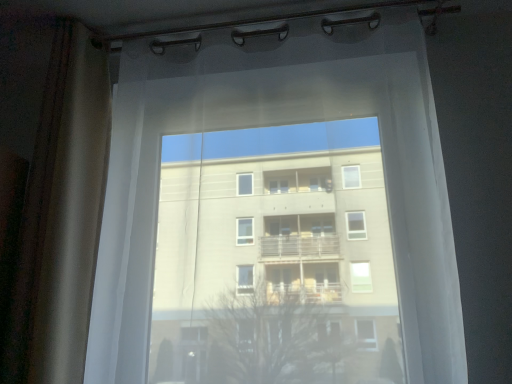
The image size is (512, 384). What are the coordinates of `brown textured curtain at left` in the screenshot? It's located at (49, 195).

What is the approximate height of brown textured curtain at left?

The height of brown textured curtain at left is 1.17 meters.

The height and width of the screenshot is (384, 512). Describe the element at coordinates (49, 195) in the screenshot. I see `brown textured curtain at left` at that location.

The width and height of the screenshot is (512, 384). I want to click on translucent white curtain at center, so click(x=277, y=210).

Describe the element at coordinates (277, 210) in the screenshot. I see `translucent white curtain at center` at that location.

The height and width of the screenshot is (384, 512). I want to click on brown textured curtain at left, so click(x=49, y=195).

Considering the relative positions of translucent white curtain at center and brown textured curtain at left in the image provided, is translucent white curtain at center to the left of brown textured curtain at left from the viewer's perspective?

Incorrect, translucent white curtain at center is not on the left side of brown textured curtain at left.

Is translucent white curtain at center in front of brown textured curtain at left?

Yes, it is in front of brown textured curtain at left.

Is point (154, 131) in front of point (69, 311)?

No, (154, 131) is further to viewer.

From the image's perspective, which is below, translucent white curtain at center or brown textured curtain at left?

translucent white curtain at center, from the image's perspective.

From a real-world perspective, relative to brown textured curtain at left, is translucent white curtain at center vertically above or below?

translucent white curtain at center is below brown textured curtain at left.

Does translucent white curtain at center have a lesser width compared to brown textured curtain at left?

No.

In terms of height, does translucent white curtain at center look taller or shorter compared to brown textured curtain at left?

In the image, translucent white curtain at center appears to be shorter than brown textured curtain at left.

Does translucent white curtain at center have a larger size compared to brown textured curtain at left?

Correct, translucent white curtain at center is larger in size than brown textured curtain at left.

Could brown textured curtain at left be considered to be inside translucent white curtain at center?

Definitely not — brown textured curtain at left is not inside translucent white curtain at center.

Are translucent white curtain at center and brown textured curtain at left located far from each other?

Actually, translucent white curtain at center and brown textured curtain at left are a little close together.

Is translucent white curtain at center looking in the opposite direction of brown textured curtain at left?

That's not correct — translucent white curtain at center is not looking away from brown textured curtain at left.

How different are the orientations of translucent white curtain at center and brown textured curtain at left in degrees?

There is a 5.86e-05-degree angle between the facing directions of translucent white curtain at center and brown textured curtain at left.

This screenshot has height=384, width=512. In order to click on curtain on the right of brown textured curtain at left in this screenshot , I will do `click(277, 210)`.

Can you confirm if brown textured curtain at left is positioned to the left of translucent white curtain at center?

Indeed, brown textured curtain at left is positioned on the left side of translucent white curtain at center.

Which is behind, brown textured curtain at left or translucent white curtain at center?

brown textured curtain at left is more distant.

Which point is more forward, (85, 43) or (324, 329)?

The point (324, 329) is closer to the camera.

From the image's perspective, who appears lower, brown textured curtain at left or translucent white curtain at center?

translucent white curtain at center appears lower in the image.

From a real-world perspective, is brown textured curtain at left beneath translucent white curtain at center?

Actually, brown textured curtain at left is physically above translucent white curtain at center in the real world.

Between brown textured curtain at left and translucent white curtain at center, which one has smaller width?

With smaller width is brown textured curtain at left.

Who is shorter, brown textured curtain at left or translucent white curtain at center?

Standing shorter between the two is translucent white curtain at center.

Looking at this image, is brown textured curtain at left smaller than translucent white curtain at center?

Indeed, brown textured curtain at left has a smaller size compared to translucent white curtain at center.

Choose the correct answer: Is brown textured curtain at left inside translucent white curtain at center or outside it?

brown textured curtain at left is located beyond the bounds of translucent white curtain at center.

Are brown textured curtain at left and translucent white curtain at center located far from each other?

Result: They are positioned close to each other.

Is brown textured curtain at left turned away from translucent white curtain at center?

No, brown textured curtain at left is not facing the opposite direction of translucent white curtain at center.

How many degrees apart are the facing directions of brown textured curtain at left and translucent white curtain at center?

Result: The facing directions of brown textured curtain at left and translucent white curtain at center are 5.86e-05 degrees apart.

The height and width of the screenshot is (384, 512). What are the coordinates of `curtain below the brown textured curtain at left (from the image's perspective)` in the screenshot? It's located at (277, 210).

Image resolution: width=512 pixels, height=384 pixels. Find the location of `curtain below the brown textured curtain at left (from the image's perspective)`. curtain below the brown textured curtain at left (from the image's perspective) is located at coordinates (277, 210).

Find the location of a particular element. The height and width of the screenshot is (384, 512). curtain on the right of the brown textured curtain at left is located at coordinates (277, 210).